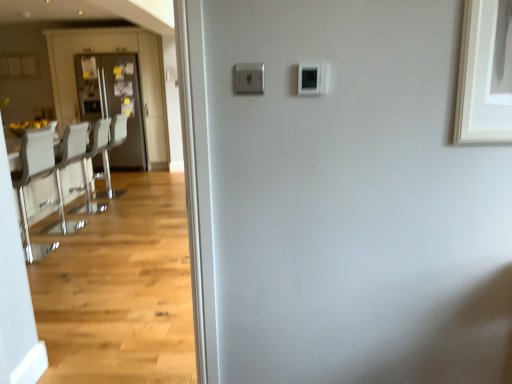
Find the location of a particular element. The height and width of the screenshot is (384, 512). vacant area that lies to the right of white glossy chair at left is located at coordinates (84, 251).